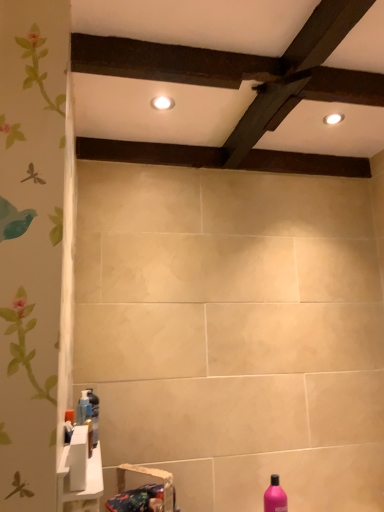
Describe the element at coordinates (143, 492) in the screenshot. I see `blue fabric sink at lower left, which appears as the 1th sink when ordered from the bottom` at that location.

Measure the distance between blue fabric sink at lower left, which appears as the 1th sink when ordered from the bottom, and camera.

They are 1.25 meters apart.

At what (x,y) coordinates should I click in order to perform the action: click on white glossy light fixture at upper right, which is the 2th lighting in front-to-back order. Please return your answer as a coordinate pair (x, y). Image resolution: width=384 pixels, height=512 pixels. Looking at the image, I should click on (333, 119).

The height and width of the screenshot is (512, 384). What do you see at coordinates (162, 103) in the screenshot?
I see `white glossy light fixture at upper center, which ranks as the first lighting in front-to-back order` at bounding box center [162, 103].

You are a GUI agent. You are given a task and a screenshot of the screen. Output one action in this format:
    pyautogui.click(x=<x>, y=<y>)
    Task: Click on the pink glossy bottle at lower right, which ranks as the 2th bottle in top-to-bottom order
    The height and width of the screenshot is (512, 384).
    Given the screenshot: What is the action you would take?
    pyautogui.click(x=275, y=497)

The height and width of the screenshot is (512, 384). Identify the location of translucent plastic bottle at lower left, the second bottle positioned from the bottom. point(94,414).

Where is `white glossy sink at lower left, arranged as the 2th sink when ordered from the bottom`? This screenshot has width=384, height=512. white glossy sink at lower left, arranged as the 2th sink when ordered from the bottom is located at coordinates (86, 483).

At what (x,y) coordinates should I click in order to perform the action: click on blue fabric sink at lower left, which appears as the 1th sink when ordered from the bottom. Please return your answer as a coordinate pair (x, y). Looking at the image, I should click on (143, 492).

Relative to blue fabric sink at lower left, the second sink viewed from the top, is white glossy light fixture at upper center, which ranks as the first lighting in front-to-back order, in front or behind?

Visually, white glossy light fixture at upper center, which ranks as the first lighting in front-to-back order, is located behind blue fabric sink at lower left, the second sink viewed from the top.

Can you confirm if white glossy light fixture at upper center, which ranks as the first lighting in front-to-back order, is shorter than blue fabric sink at lower left, the second sink viewed from the top?

Yes.

Which object is positioned more to the right, white glossy light fixture at upper center, positioned as the second lighting in back-to-front order, or blue fabric sink at lower left, which appears as the 1th sink when ordered from the bottom?

white glossy light fixture at upper center, positioned as the second lighting in back-to-front order, is more to the right.

Is dark brown wood at upper center directly adjacent to white glossy sink at lower left, arranged as the 2th sink when ordered from the bottom?

No, dark brown wood at upper center is not touching white glossy sink at lower left, arranged as the 2th sink when ordered from the bottom.

Which is more distant, (89, 145) or (68, 446)?

The point (89, 145) is more distant.

Which is in front, dark brown wood at upper center or white glossy sink at lower left, the 1th sink in the top-to-bottom sequence?

white glossy sink at lower left, the 1th sink in the top-to-bottom sequence, is in front.

Is dark brown wood at upper center aimed at white glossy sink at lower left, the 1th sink in the top-to-bottom sequence?

No.

Is white glossy sink at lower left, the 1th sink in the top-to-bottom sequence, located within blue fabric sink at lower left, the second sink viewed from the top?

No, white glossy sink at lower left, the 1th sink in the top-to-bottom sequence, is not a part of blue fabric sink at lower left, the second sink viewed from the top.

Is blue fabric sink at lower left, the second sink viewed from the top, at the right side of white glossy sink at lower left, arranged as the 2th sink when ordered from the bottom?

Yes.

From a real-world perspective, which object rests below the other?

In real-world perspective, blue fabric sink at lower left, the second sink viewed from the top, is lower.

Is the depth of translucent plastic bottle at lower left, which is the first bottle in top-to-bottom order, greater than that of white glossy sink at lower left, arranged as the 2th sink when ordered from the bottom?

That is True.

Is translucent plastic bottle at lower left, the second bottle positioned from the bottom, inside the boundaries of white glossy sink at lower left, arranged as the 2th sink when ordered from the bottom, or outside?

translucent plastic bottle at lower left, the second bottle positioned from the bottom, is enclosed within white glossy sink at lower left, arranged as the 2th sink when ordered from the bottom.

What's the angular difference between translucent plastic bottle at lower left, the 2th bottle viewed from the right, and white glossy sink at lower left, the 1th sink in the top-to-bottom sequence,'s facing directions?

The facing directions of translucent plastic bottle at lower left, the 2th bottle viewed from the right, and white glossy sink at lower left, the 1th sink in the top-to-bottom sequence, are 0.849 degrees apart.

In the image, there is a blue fabric sink at lower left, the second sink viewed from the top. Identify the location of bottle below it (from the image's perspective). (275, 497).

Can you confirm if blue fabric sink at lower left, which appears as the 1th sink when ordered from the bottom, is thinner than pink glossy bottle at lower right, which appears as the 1th bottle when viewed from the right?

Incorrect, the width of blue fabric sink at lower left, which appears as the 1th sink when ordered from the bottom, is not less than that of pink glossy bottle at lower right, which appears as the 1th bottle when viewed from the right.

Can you confirm if blue fabric sink at lower left, the second sink viewed from the top, is taller than pink glossy bottle at lower right, the 2th bottle when ordered from left to right?

No, blue fabric sink at lower left, the second sink viewed from the top, is not taller than pink glossy bottle at lower right, the 2th bottle when ordered from left to right.

Considering the relative positions of white glossy light fixture at upper center, positioned as the second lighting in back-to-front order, and dark brown wood at upper center in the image provided, is white glossy light fixture at upper center, positioned as the second lighting in back-to-front order, to the left or to the right of dark brown wood at upper center?

white glossy light fixture at upper center, positioned as the second lighting in back-to-front order, is positioned on dark brown wood at upper center's left side.

Who is shorter, white glossy light fixture at upper center, the 1th lighting viewed from the left, or dark brown wood at upper center?

white glossy light fixture at upper center, the 1th lighting viewed from the left.

Looking at this image, is white glossy light fixture at upper center, which appears as the second lighting when viewed from the right, outside of dark brown wood at upper center?

Yes.

In the scene shown: How many degrees apart are the facing directions of pink glossy bottle at lower right, which appears as the 1th bottle when viewed from the right, and white glossy sink at lower left, arranged as the 2th sink when ordered from the bottom?

The angle between the facing direction of pink glossy bottle at lower right, which appears as the 1th bottle when viewed from the right, and the facing direction of white glossy sink at lower left, arranged as the 2th sink when ordered from the bottom, is 179 degrees.

You are a GUI agent. You are given a task and a screenshot of the screen. Output one action in this format:
    pyautogui.click(x=<x>, y=<y>)
    Task: Click on the 2nd sink in front of the pink glossy bottle at lower right, the 2th bottle when ordered from left to right, counting from the anchor's position
    Image resolution: width=384 pixels, height=512 pixels.
    Given the screenshot: What is the action you would take?
    pyautogui.click(x=86, y=483)

Is point (265, 510) less distant than point (82, 393)?

Yes, it is in front of point (82, 393).

From the image's perspective, is pink glossy bottle at lower right, which appears as the 1th bottle when viewed from the right, under white glossy sink at lower left, arranged as the 2th sink when ordered from the bottom?

Yes, from the image's perspective, pink glossy bottle at lower right, which appears as the 1th bottle when viewed from the right, is beneath white glossy sink at lower left, arranged as the 2th sink when ordered from the bottom.

Find the location of `the 1st sink counting from the left side of the white glossy light fixture at upper center, which ranks as the first lighting in front-to-back order`. the 1st sink counting from the left side of the white glossy light fixture at upper center, which ranks as the first lighting in front-to-back order is located at coordinates (143, 492).

The width and height of the screenshot is (384, 512). What are the coordinates of `plank behind the white glossy sink at lower left, arranged as the 2th sink when ordered from the bottom` in the screenshot? It's located at (149, 153).

Considering their positions, is dark brown wood at upper center positioned closer to blue fabric sink at lower left, which appears as the 1th sink when ordered from the bottom, than pink glossy bottle at lower right, acting as the first bottle starting from the back?

pink glossy bottle at lower right, acting as the first bottle starting from the back.

Considering their positions, is translucent plastic bottle at lower left, which is the first bottle in top-to-bottom order, positioned closer to white glossy sink at lower left, arranged as the 2th sink when ordered from the bottom, than blue fabric sink at lower left, which appears as the 1th sink when ordered from the bottom?

blue fabric sink at lower left, which appears as the 1th sink when ordered from the bottom, is positioned closer to the anchor white glossy sink at lower left, arranged as the 2th sink when ordered from the bottom.

Based on their spatial positions, is white glossy light fixture at upper center, which appears as the second lighting when viewed from the right, or white glossy light fixture at upper right, acting as the 1th lighting starting from the back, closer to pink glossy bottle at lower right, acting as the first bottle starting from the back?

white glossy light fixture at upper right, acting as the 1th lighting starting from the back, is closer to pink glossy bottle at lower right, acting as the first bottle starting from the back.

Which object lies nearer to the anchor point white glossy sink at lower left, arranged as the 2th sink when ordered from the bottom, translucent plastic bottle at lower left, the 2th bottle viewed from the right, or dark brown wood at upper center?

translucent plastic bottle at lower left, the 2th bottle viewed from the right, is closer to white glossy sink at lower left, arranged as the 2th sink when ordered from the bottom.

Based on their spatial positions, is blue fabric sink at lower left, the second sink viewed from the top, or white glossy light fixture at upper right, which is the 2th lighting in front-to-back order, further from white glossy light fixture at upper center, which appears as the second lighting when viewed from the right?

blue fabric sink at lower left, the second sink viewed from the top.

Based on their spatial positions, is dark brown wood at upper center or translucent plastic bottle at lower left, the first bottle from the front, further from white glossy light fixture at upper right, which is the 2th lighting in front-to-back order?

The object further to white glossy light fixture at upper right, which is the 2th lighting in front-to-back order, is translucent plastic bottle at lower left, the first bottle from the front.

Looking at the image, which one is located further to white glossy light fixture at upper center, which ranks as the first lighting in front-to-back order, blue fabric sink at lower left, the second sink viewed from the top, or white glossy sink at lower left, the 1th sink in the top-to-bottom sequence?

Among the two, blue fabric sink at lower left, the second sink viewed from the top, is located further to white glossy light fixture at upper center, which ranks as the first lighting in front-to-back order.

When comparing their distances from white glossy light fixture at upper center, the 1th lighting viewed from the left, does pink glossy bottle at lower right, acting as the first bottle starting from the bottom, or blue fabric sink at lower left, which appears as the 1th sink when ordered from the bottom, seem further?

pink glossy bottle at lower right, acting as the first bottle starting from the bottom, lies further to white glossy light fixture at upper center, the 1th lighting viewed from the left, than the other object.

The height and width of the screenshot is (512, 384). I want to click on lighting between white glossy light fixture at upper center, which appears as the second lighting when viewed from the right, and pink glossy bottle at lower right, acting as the first bottle starting from the bottom, in the up-down direction, so click(333, 119).

Where is `plank that lies between white glossy light fixture at upper right, the 2th lighting positioned from the left, and translucent plastic bottle at lower left, the second bottle positioned from the bottom, from top to bottom`? plank that lies between white glossy light fixture at upper right, the 2th lighting positioned from the left, and translucent plastic bottle at lower left, the second bottle positioned from the bottom, from top to bottom is located at coordinates (149, 153).

Where is `bottle between dark brown wood at upper center and white glossy sink at lower left, the 1th sink in the top-to-bottom sequence, from top to bottom`? The image size is (384, 512). bottle between dark brown wood at upper center and white glossy sink at lower left, the 1th sink in the top-to-bottom sequence, from top to bottom is located at coordinates (94, 414).

The image size is (384, 512). Find the location of `sink between white glossy light fixture at upper right, the first lighting positioned from the right, and blue fabric sink at lower left, which appears as the 1th sink when ordered from the bottom, in the up-down direction`. sink between white glossy light fixture at upper right, the first lighting positioned from the right, and blue fabric sink at lower left, which appears as the 1th sink when ordered from the bottom, in the up-down direction is located at coordinates (86, 483).